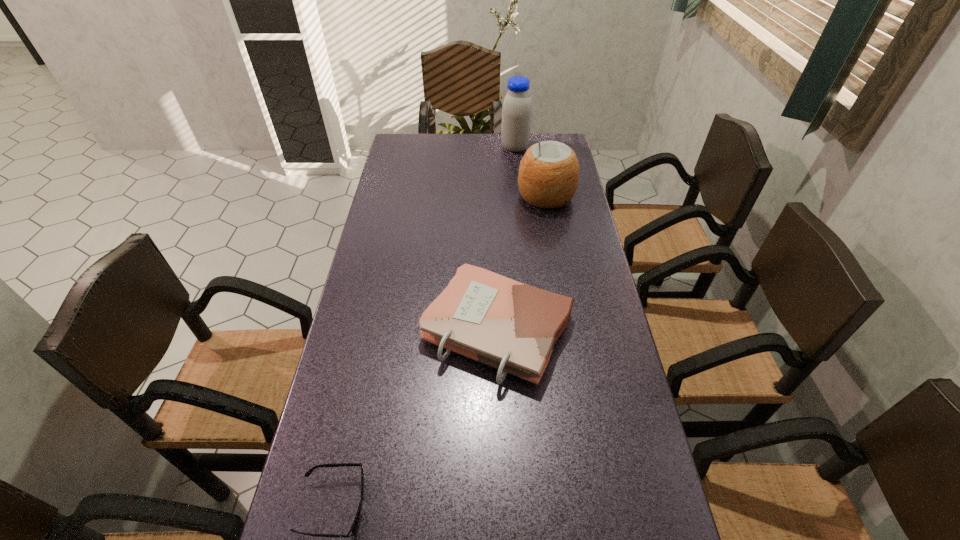
At what (x,y) coordinates should I click in order to perform the action: click on phonebook at the right edge. Please return your answer as a coordinate pair (x, y). The height and width of the screenshot is (540, 960). Looking at the image, I should click on [x=513, y=327].

The image size is (960, 540). In order to click on object that is at the far right corner in this screenshot , I will do `click(517, 106)`.

Locate an element on the screen. vacant space at the far edge of the desktop is located at coordinates (477, 163).

Locate an element on the screen. vacant area at the left edge is located at coordinates (378, 490).

In the image, there is a desktop. Identify the location of vacant space at the right edge. (562, 284).

The height and width of the screenshot is (540, 960). Find the location of `blank space at the far left corner of the desktop`. blank space at the far left corner of the desktop is located at coordinates (399, 153).

Locate an element on the screen. vacant position at the far right corner of the desktop is located at coordinates (545, 139).

Locate an element on the screen. empty location between the second farthest object and the third tallest object is located at coordinates (521, 263).

This screenshot has width=960, height=540. I want to click on blank region between the phonebook and the third nearest object, so (x=521, y=263).

You are a GUI agent. You are given a task and a screenshot of the screen. Output one action in this format:
    pyautogui.click(x=<x>, y=<y>)
    Task: Click on the vacant space that's between the second shortest object and the coconut
    The width and height of the screenshot is (960, 540).
    Given the screenshot: What is the action you would take?
    pyautogui.click(x=521, y=263)